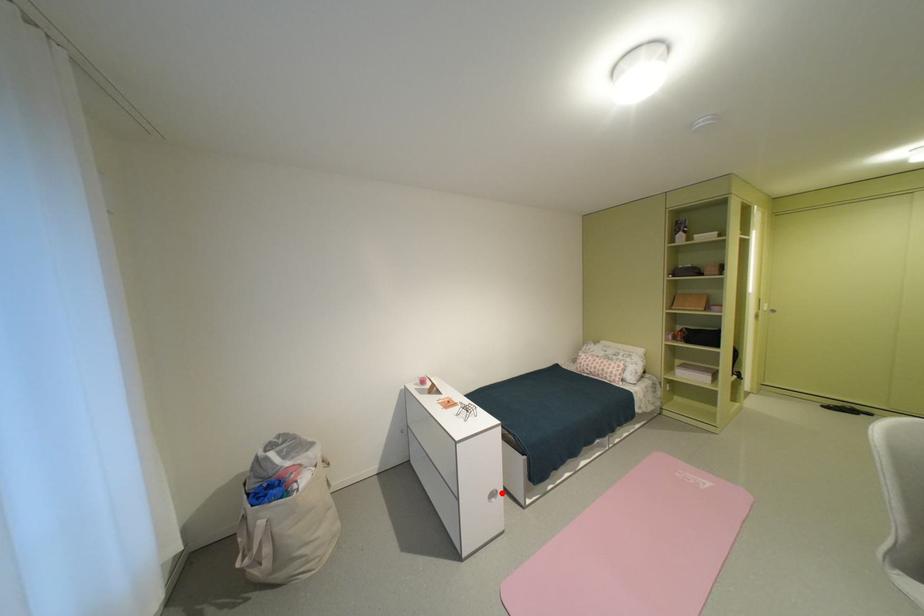
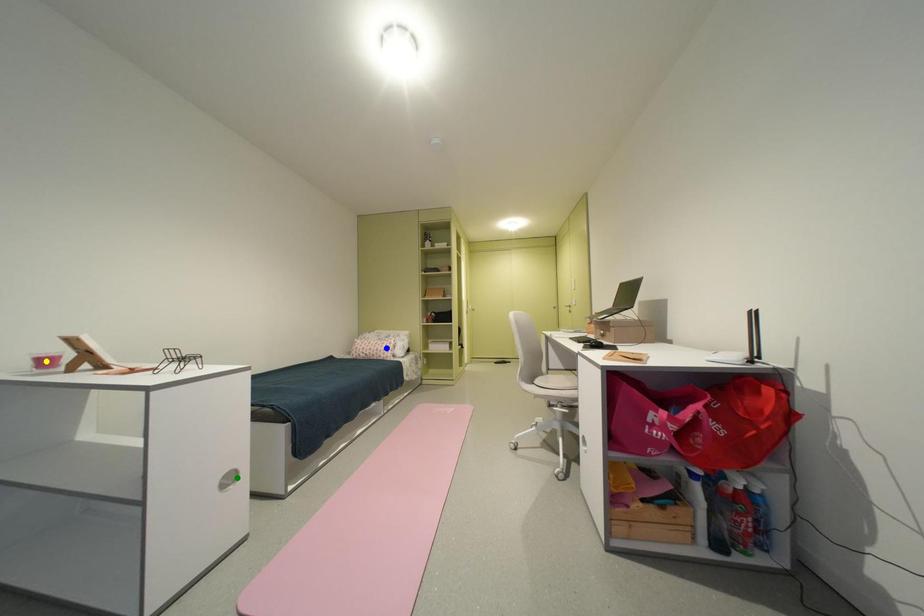
Question: I am providing you with two images of the same scene from different viewpoints. A red point is marked on the first image. You are given multiple points on the second image. Which point in image 2 represents the same 3d spot as the red point in image 1?

Choices:
 (A) green point
 (B) blue point
 (C) yellow point

Answer: (A)